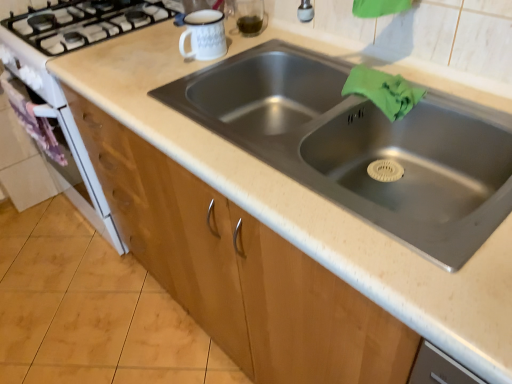
At what (x,y) coordinates should I click in order to perform the action: click on green fabric at sink right. Please return your answer as a coordinate pair (x, y). Looking at the image, I should click on click(x=383, y=91).

Describe the element at coordinates (383, 91) in the screenshot. I see `green fabric at sink right` at that location.

Identify the location of stainless steel sink at center. pos(361,145).

Image resolution: width=512 pixels, height=384 pixels. What do you see at coordinates (240, 270) in the screenshot?
I see `wooden cabinet at lower center` at bounding box center [240, 270].

At what (x,y) coordinates should I click in order to perform the action: click on green fabric at sink right. Please return your answer as a coordinate pair (x, y). The image size is (512, 384). Looking at the image, I should click on (383, 91).

In terms of width, does stainless steel sink at center look wider or thinner when compared to wooden cabinet at lower center?

stainless steel sink at center is thinner than wooden cabinet at lower center.

Which point is more distant from viewer, (507, 148) or (376, 349)?

Point (507, 148)

From a real-world perspective, does stainless steel sink at center stand above wooden cabinet at lower center?

Indeed, from a real-world perspective, stainless steel sink at center stands above wooden cabinet at lower center.

In the scene shown: Considering the sizes of objects stainless steel sink at center and wooden cabinet at lower center in the image provided, who is shorter, stainless steel sink at center or wooden cabinet at lower center?

Standing shorter between the two is wooden cabinet at lower center.

Looking at this image, which of these two, wooden cabinet at lower center or stainless steel sink at center, is thinner?

With smaller width is stainless steel sink at center.

From the image's perspective, is wooden cabinet at lower center located beneath stainless steel sink at center?

Yes, from the image's perspective, wooden cabinet at lower center is below stainless steel sink at center.

Looking at this image, considering the positions of objects wooden cabinet at lower center and stainless steel sink at center in the image provided, who is more to the right, wooden cabinet at lower center or stainless steel sink at center?

Positioned to the right is stainless steel sink at center.

From a real-world perspective, which is physically below, wooden cabinet at lower center or stainless steel sink at center?

In real-world perspective, wooden cabinet at lower center is lower.

From the image's perspective, is green fabric at sink right over wooden cabinet at lower center?

Yes, from the image's perspective, green fabric at sink right is on top of wooden cabinet at lower center.

How different are the orientations of green fabric at sink right and wooden cabinet at lower center in degrees?

They differ by 90 degrees in their facing directions.

Looking at this image, considering the relative sizes of green fabric at sink right and wooden cabinet at lower center in the image provided, is green fabric at sink right thinner than wooden cabinet at lower center?

Yes.

Is green fabric at sink right oriented away from wooden cabinet at lower center?

No, wooden cabinet at lower center is not at the back of green fabric at sink right.

Considering the positions of objects stainless steel sink at center and green fabric at sink right in the image provided, who is in front, stainless steel sink at center or green fabric at sink right?

stainless steel sink at center.

Measure the distance between stainless steel sink at center and green fabric at sink right.

stainless steel sink at center and green fabric at sink right are 7.13 inches apart from each other.

Considering the sizes of objects stainless steel sink at center and green fabric at sink right in the image provided, who is bigger, stainless steel sink at center or green fabric at sink right?

stainless steel sink at center is bigger.

From a real-world perspective, who is located lower, stainless steel sink at center or green fabric at sink right?

In real-world perspective, stainless steel sink at center is lower.

Are green fabric at sink right and stainless steel sink at center located far from each other?

No, green fabric at sink right is in close proximity to stainless steel sink at center.

Is green fabric at sink right completely or partially outside of stainless steel sink at center?

No, green fabric at sink right is not outside of stainless steel sink at center.

Based on the photo, which point is more distant from viewer, (x=366, y=89) or (x=510, y=176)?

Point (x=366, y=89)

Considering the relative sizes of green fabric at sink right and stainless steel sink at center in the image provided, is green fabric at sink right smaller than stainless steel sink at center?

Yes, green fabric at sink right is smaller than stainless steel sink at center.

I want to click on cabinetry that appears below the green fabric at sink right (from the image's perspective), so click(x=240, y=270).

Is wooden cabinet at lower center wider than green fabric at sink right?

Indeed, wooden cabinet at lower center has a greater width compared to green fabric at sink right.

What's the angular difference between wooden cabinet at lower center and green fabric at sink right's facing directions?

The angle between the facing direction of wooden cabinet at lower center and the facing direction of green fabric at sink right is 90 degrees.

Who is taller, wooden cabinet at lower center or green fabric at sink right?

green fabric at sink right is taller.

What are the coordinates of `sink above the wooden cabinet at lower center (from the image's perspective)` in the screenshot? It's located at (361, 145).

At what (x,y) coordinates should I click in order to perform the action: click on sink that is above the wooden cabinet at lower center (from a real-world perspective). Please return your answer as a coordinate pair (x, y). The height and width of the screenshot is (384, 512). Looking at the image, I should click on (361, 145).

When comparing their distances from stainless steel sink at center, does wooden cabinet at lower center or green fabric at sink right seem closer?

Among the two, green fabric at sink right is located nearer to stainless steel sink at center.

Which object lies further to the anchor point green fabric at sink right, stainless steel sink at center or wooden cabinet at lower center?

Among the two, wooden cabinet at lower center is located further to green fabric at sink right.

Looking at the image, which one is located further to green fabric at sink right, wooden cabinet at lower center or stainless steel sink at center?

wooden cabinet at lower center.

Which object lies nearer to the anchor point stainless steel sink at center, green fabric at sink right or wooden cabinet at lower center?

green fabric at sink right lies closer to stainless steel sink at center than the other object.

Looking at the image, which one is located closer to wooden cabinet at lower center, stainless steel sink at center or green fabric at sink right?

stainless steel sink at center is closer to wooden cabinet at lower center.

From the image, which object appears to be farther from wooden cabinet at lower center, green fabric at sink right or stainless steel sink at center?

green fabric at sink right is positioned further to the anchor wooden cabinet at lower center.

This screenshot has width=512, height=384. I want to click on sink situated between wooden cabinet at lower center and green fabric at sink right from left to right, so (x=361, y=145).